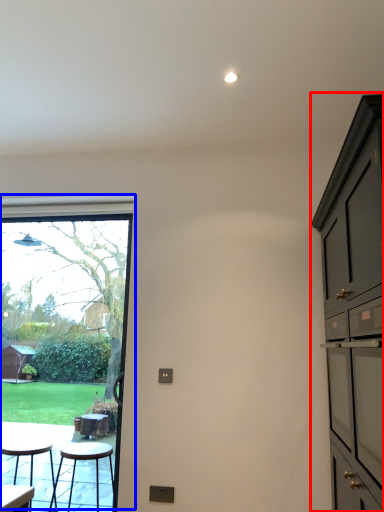
Question: Which of the following is the farthest to the observer, cabinetry (highlighted by a red box) or window (highlighted by a blue box)?

Choices:
 (A) cabinetry
 (B) window

Answer: (B)